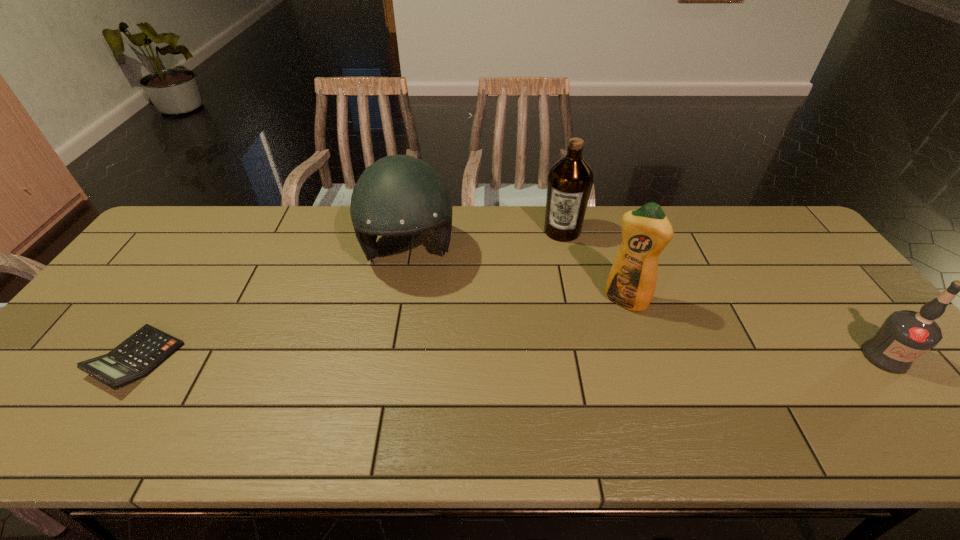
The image size is (960, 540). I want to click on free location at the near right corner, so click(x=873, y=389).

You are a GUI agent. You are given a task and a screenshot of the screen. Output one action in this format:
    pyautogui.click(x=<x>, y=<y>)
    Task: Click on the free spot between the detergent and the football helmet
    The image size is (960, 540).
    Given the screenshot: What is the action you would take?
    pyautogui.click(x=516, y=276)

Where is `free space between the leftmost object and the second object from right to left`? free space between the leftmost object and the second object from right to left is located at coordinates (381, 330).

Where is `empty space that is in between the leftmost object and the olive oil`? Image resolution: width=960 pixels, height=540 pixels. empty space that is in between the leftmost object and the olive oil is located at coordinates (349, 295).

I want to click on vacant space in between the vodka and the calculator, so click(x=511, y=358).

You are a GUI agent. You are given a task and a screenshot of the screen. Output one action in this format:
    pyautogui.click(x=<x>, y=<y>)
    Task: Click on the empty location between the shortest object and the football helmet
    This screenshot has height=540, width=960.
    Given the screenshot: What is the action you would take?
    pyautogui.click(x=273, y=306)

Where is `vacant point located between the football helmet and the detergent`? Image resolution: width=960 pixels, height=540 pixels. vacant point located between the football helmet and the detergent is located at coordinates (516, 276).

You are a GUI agent. You are given a task and a screenshot of the screen. Output one action in this format:
    pyautogui.click(x=<x>, y=<y>)
    Task: Click on the unoccupied area between the calculator and the fourth object from right to left
    The image size is (960, 540).
    Given the screenshot: What is the action you would take?
    pyautogui.click(x=273, y=306)

Locate which object ranks third in proximity to the rightmost object. Please provide its 2D coordinates. Your answer should be formatted as a tuple, i.e. [(x, y)], where the tuple contains the x and y coordinates of a point satisfying the conditions above.

[(398, 195)]

Identify the location of the third closest object to the calculator. The image size is (960, 540). (646, 231).